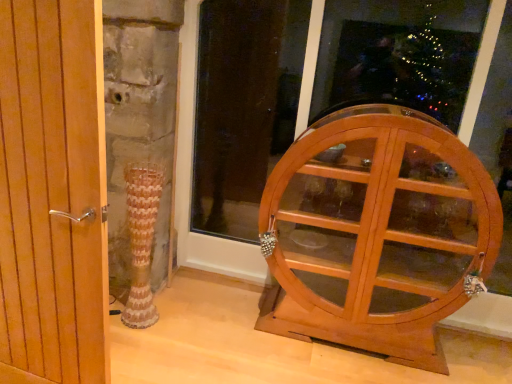
You are a GUI agent. You are given a task and a screenshot of the screen. Output one action in this format:
    pyautogui.click(x=<x>, y=<y>)
    Task: Click on the blank area to the left of light brown wooden cabinet at right
    
    Given the screenshot: What is the action you would take?
    pyautogui.click(x=223, y=340)